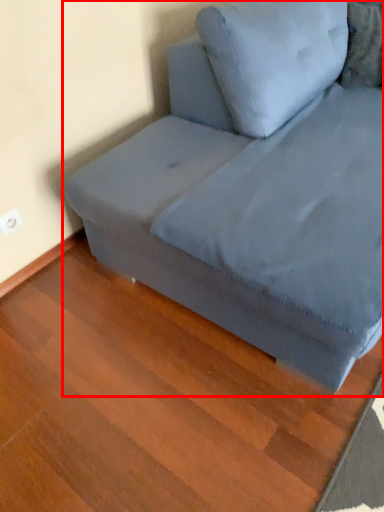
Question: Considering the relative positions of studio couch (annotated by the red box) and pillow in the image provided, where is studio couch (annotated by the red box) located with respect to the staircase?

Choices:
 (A) left
 (B) right

Answer: (A)